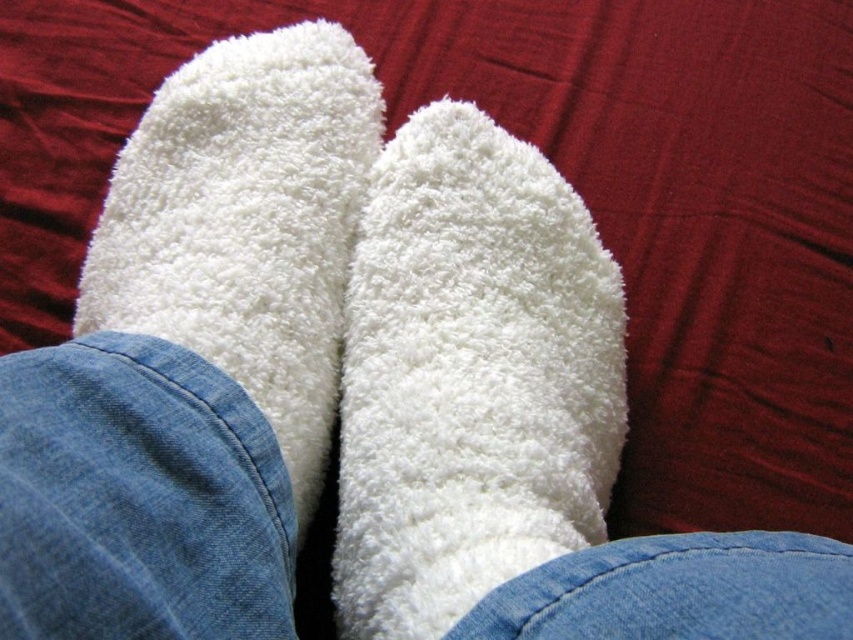
Question: Is white fluffy sock at center smaller than white fluffy socks at center?

Choices:
 (A) yes
 (B) no

Answer: (A)

Question: Can you confirm if white fluffy sock at center is thinner than white fluffy socks at center?

Choices:
 (A) no
 (B) yes

Answer: (B)

Question: Does white fluffy sock at center appear on the right side of white fluffy socks at center?

Choices:
 (A) no
 (B) yes

Answer: (B)

Question: Which point is farther to the camera?

Choices:
 (A) (218, 125)
 (B) (532, 218)

Answer: (A)